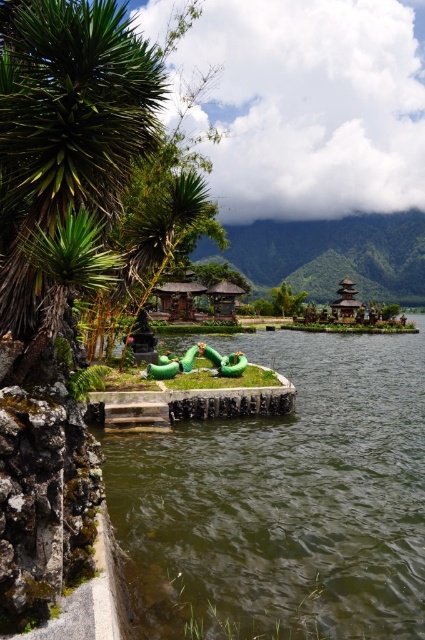
You are a visitor standing on the shore of the lake and want to know which object is taller between the green rubber tubes at center and the green leafy palm tree at left. Based on the scene, can you determine which one is taller?

The green leafy palm tree at left is taller than the green rubber tubes at center.

You are planning to build a floating dock using the green rubber tubes at center and need to anchor it near the green leafy palm tree at left. Considering their sizes, which object is wider?

The green rubber tubes at center are wider than the green leafy palm tree at left because the green rubber tubes at center have a greater width as stated in the description.